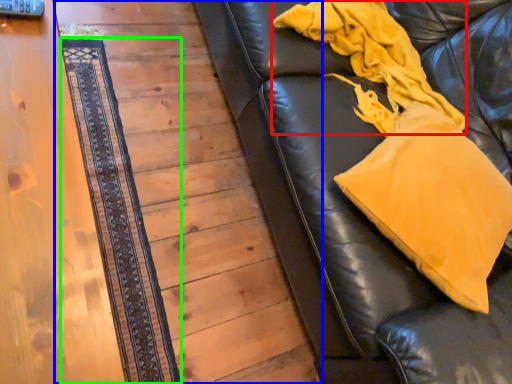
Question: Based on their relative distances, which object is nearer to blanket (highlighted by a red box)? Choose from panel (highlighted by a blue box) and mat (highlighted by a green box).

Choices:
 (A) panel
 (B) mat

Answer: (A)